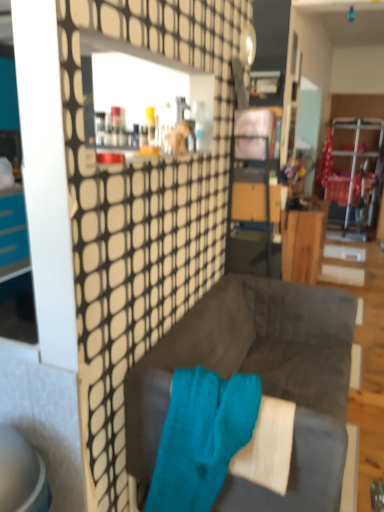
Describe the element at coordinates (304, 243) in the screenshot. This screenshot has height=512, width=384. I see `wooden desk at center` at that location.

I want to click on teal soft towel at center, so click(201, 438).

The height and width of the screenshot is (512, 384). Identify the location of wooden desk at center. (304, 243).

Does wooden desk at center have a greater height compared to velvet dark gray couch at center?

Indeed, wooden desk at center has a greater height compared to velvet dark gray couch at center.

From a real-world perspective, is wooden desk at center positioned above or below velvet dark gray couch at center?

Clearly, from a real-world perspective, wooden desk at center is above velvet dark gray couch at center.

Is wooden desk at center oriented away from velvet dark gray couch at center?

No, wooden desk at center is not facing away from velvet dark gray couch at center.

Is teal soft towel at center looking in the opposite direction of velvet dark gray couch at center?

Yes, teal soft towel at center is facing away from velvet dark gray couch at center.

Which point is more distant from viewer, (154, 467) or (321, 358)?

The point (321, 358) is behind.

Considering the sizes of teal soft towel at center and velvet dark gray couch at center in the image, is teal soft towel at center bigger or smaller than velvet dark gray couch at center?

In the image, teal soft towel at center appears to be smaller than velvet dark gray couch at center.

Is teal soft towel at center directly adjacent to velvet dark gray couch at center?

No, teal soft towel at center is not beside velvet dark gray couch at center.

From a real-world perspective, relative to teal soft towel at center, is wooden desk at center vertically above or below?

Clearly, from a real-world perspective, wooden desk at center is below teal soft towel at center.

Is wooden desk at center shorter than teal soft towel at center?

Incorrect, the height of wooden desk at center does not fall short of that of teal soft towel at center.

Is wooden desk at center touching teal soft towel at center?

They are not placed beside each other.

From the image's perspective, relative to teal soft towel at center, is wooden desk at center above or below?

wooden desk at center is above teal soft towel at center.

Locate an element on the screen. bath towel in front of the wooden desk at center is located at coordinates (201, 438).

Is teal soft towel at center positioned far away from wooden desk at center?

Yes.

Between teal soft towel at center and wooden desk at center, which one is positioned in front?

Positioned in front is teal soft towel at center.

Is teal soft towel at center looking in the opposite direction of wooden desk at center?

Yes.

In the image, is velvet dark gray couch at center positioned in front of or behind teal soft towel at center?

In the image, velvet dark gray couch at center appears behind teal soft towel at center.

Is velvet dark gray couch at center oriented away from teal soft towel at center?

velvet dark gray couch at center is not turned away from teal soft towel at center.

Is velvet dark gray couch at center taller than teal soft towel at center?

Correct, velvet dark gray couch at center is much taller as teal soft towel at center.

From a real-world perspective, who is located higher, velvet dark gray couch at center or teal soft towel at center?

teal soft towel at center, from a real-world perspective.

Is velvet dark gray couch at center at the right side of wooden desk at center?

In fact, velvet dark gray couch at center is to the left of wooden desk at center.

Between velvet dark gray couch at center and wooden desk at center, which one has less height?

velvet dark gray couch at center.

From a real-world perspective, which object stands above the other?

wooden desk at center.

From the image's perspective, is velvet dark gray couch at center above or below wooden desk at center?

From the image's perspective, velvet dark gray couch at center appears below wooden desk at center.

Where is `studio couch on the left of wooden desk at center`? The image size is (384, 512). studio couch on the left of wooden desk at center is located at coordinates (262, 381).

In the image, there is a velvet dark gray couch at center. Where is `bath towel below it (from the image's perspective)`? This screenshot has height=512, width=384. bath towel below it (from the image's perspective) is located at coordinates (201, 438).

Considering their positions, is wooden desk at center positioned further to teal soft towel at center than velvet dark gray couch at center?

wooden desk at center is further to teal soft towel at center.

From the image, which object appears to be nearer to teal soft towel at center, velvet dark gray couch at center or wooden desk at center?

velvet dark gray couch at center is closer to teal soft towel at center.

From the image, which object appears to be nearer to velvet dark gray couch at center, teal soft towel at center or wooden desk at center?

teal soft towel at center is positioned closer to the anchor velvet dark gray couch at center.

Estimate the real-world distances between objects in this image. Which object is closer to wooden desk at center, velvet dark gray couch at center or teal soft towel at center?

velvet dark gray couch at center is positioned closer to the anchor wooden desk at center.

Looking at the image, which one is located closer to velvet dark gray couch at center, wooden desk at center or teal soft towel at center?

teal soft towel at center is closer to velvet dark gray couch at center.

When comparing their distances from wooden desk at center, does teal soft towel at center or velvet dark gray couch at center seem further?

teal soft towel at center is positioned further to the anchor wooden desk at center.

Locate an element on the screen. The height and width of the screenshot is (512, 384). studio couch positioned between teal soft towel at center and wooden desk at center from near to far is located at coordinates (262, 381).